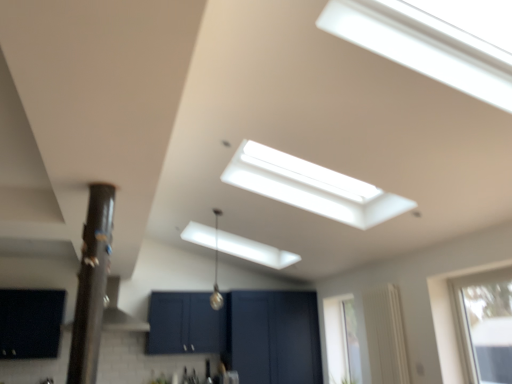
Describe the element at coordinates (119, 311) in the screenshot. I see `satin silver exhaust hood at left` at that location.

What do you see at coordinates (450, 319) in the screenshot?
I see `transparent glass window at upper right, acting as the 3th window starting from the back` at bounding box center [450, 319].

Locate an element on the screen. matte black cabinet at lower left, the second window viewed from the back is located at coordinates (30, 323).

Does point (480, 267) appear closer or farther from the camera than point (342, 312)?

Point (480, 267) is closer to the camera than point (342, 312).

Considering the relative positions of transparent glass window at upper right, acting as the 3th window starting from the back, and clear glass window at right, marked as the second window in a right-to-left arrangement, in the image provided, is transparent glass window at upper right, acting as the 3th window starting from the back, to the right of clear glass window at right, marked as the second window in a right-to-left arrangement, from the viewer's perspective?

Yes.

From the image's perspective, is transparent glass window at upper right, acting as the 3th window starting from the back, located above clear glass window at right, marked as the second window in a right-to-left arrangement?

Yes.

Measure the distance between transparent glass window at upper right, placed as the 1th window when sorted from front to back, and clear glass window at right, which ranks as the first window in back-to-front order.

transparent glass window at upper right, placed as the 1th window when sorted from front to back, and clear glass window at right, which ranks as the first window in back-to-front order, are 1.53 meters apart.

Could you tell me if matte black cabinet at lower left, the 2th window from the front, is facing metallic silver light fixture at upper center?

No.

What's the angular difference between matte black cabinet at lower left, which is counted as the 1th window, starting from the left, and metallic silver light fixture at upper center's facing directions?

There is a 89.8-degree angle between the facing directions of matte black cabinet at lower left, which is counted as the 1th window, starting from the left, and metallic silver light fixture at upper center.

From the picture: Do you think matte black cabinet at lower left, the 3th window viewed from the right, is within metallic silver light fixture at upper center, or outside of it?

matte black cabinet at lower left, the 3th window viewed from the right, cannot be found inside metallic silver light fixture at upper center.

Between matte black cabinet at lower left, the 2th window from the front, and metallic silver light fixture at upper center, which one is positioned in front?

metallic silver light fixture at upper center.

In the image, is satin silver exhaust hood at left positioned in front of or behind metallic silver light fixture at upper center?

Visually, satin silver exhaust hood at left is located behind metallic silver light fixture at upper center.

Is point (116, 321) closer to viewer compared to point (217, 212)?

No, (116, 321) is behind (217, 212).

From the image's perspective, is satin silver exhaust hood at left under metallic silver light fixture at upper center?

Correct, satin silver exhaust hood at left appears lower than metallic silver light fixture at upper center in the image.

What's the angular difference between satin silver exhaust hood at left and metallic silver light fixture at upper center's facing directions?

The facing directions of satin silver exhaust hood at left and metallic silver light fixture at upper center are 91 degrees apart.

Which object is thinner, matte black cabinet at lower left, the second window viewed from the back, or satin silver exhaust hood at left?

With smaller width is matte black cabinet at lower left, the second window viewed from the back.

Is matte black cabinet at lower left, the 3th window viewed from the right, with satin silver exhaust hood at left?

No, matte black cabinet at lower left, the 3th window viewed from the right, is not next to satin silver exhaust hood at left.

From the picture: Visually, is clear glass window at right, marked as the second window in a right-to-left arrangement, positioned to the left or to the right of transparent glass window at upper right, marked as the 3th window in a left-to-right arrangement?

Clearly, clear glass window at right, marked as the second window in a right-to-left arrangement, is on the left of transparent glass window at upper right, marked as the 3th window in a left-to-right arrangement, in the image.

In the scene shown: How many degrees apart are the facing directions of clear glass window at right, marked as the second window in a right-to-left arrangement, and transparent glass window at upper right, marked as the 3th window in a left-to-right arrangement?

The angular difference between clear glass window at right, marked as the second window in a right-to-left arrangement, and transparent glass window at upper right, marked as the 3th window in a left-to-right arrangement, is 0.122 degrees.

From the image's perspective, would you say clear glass window at right, which ranks as the first window in back-to-front order, is positioned over transparent glass window at upper right, acting as the 3th window starting from the back?

No, from the image's perspective, clear glass window at right, which ranks as the first window in back-to-front order, is not on top of transparent glass window at upper right, acting as the 3th window starting from the back.

In terms of size, does matte black cabinet at lower left, the second window viewed from the back, appear bigger or smaller than dark blue matte cabinet at center?

Considering their sizes, matte black cabinet at lower left, the second window viewed from the back, takes up less space than dark blue matte cabinet at center.

Find the location of a particular element. Image resolution: width=512 pixels, height=384 pixels. window above the dark blue matte cabinet at center (from a real-world perspective) is located at coordinates (30, 323).

Considering the relative sizes of matte black cabinet at lower left, the second window viewed from the back, and dark blue matte cabinet at center in the image provided, is matte black cabinet at lower left, the second window viewed from the back, shorter than dark blue matte cabinet at center?

Yes, matte black cabinet at lower left, the second window viewed from the back, is shorter than dark blue matte cabinet at center.

Consider the image. Is matte black cabinet at lower left, which is counted as the 1th window, starting from the left, wider or thinner than dark blue matte cabinet at center?

In the image, matte black cabinet at lower left, which is counted as the 1th window, starting from the left, appears to be more narrow than dark blue matte cabinet at center.

Is matte black cabinet at lower left, the 2th window from the front, spatially inside clear glass window at right, which ranks as the first window in back-to-front order, or outside of it?

matte black cabinet at lower left, the 2th window from the front, cannot be found inside clear glass window at right, which ranks as the first window in back-to-front order.

Looking at this image, what's the angular difference between matte black cabinet at lower left, the 3th window viewed from the right, and clear glass window at right, which ranks as the first window in back-to-front order,'s facing directions?

They differ by 88.6 degrees in their facing directions.

Is matte black cabinet at lower left, the second window viewed from the back, looking in the opposite direction of clear glass window at right, which is counted as the third window, starting from the front?

matte black cabinet at lower left, the second window viewed from the back, does not have its back to clear glass window at right, which is counted as the third window, starting from the front.

From a real-world perspective, who is located higher, matte black cabinet at lower left, the 2th window from the front, or clear glass window at right, which is the second window from left to right?

matte black cabinet at lower left, the 2th window from the front.

From the image's perspective, starting from the transparent glass window at upper right, positioned as the 1th window in right-to-left order, which window is the 2nd one below? Please provide its 2D coordinates.

[(342, 340)]

This screenshot has width=512, height=384. In order to click on window to the left of metallic silver light fixture at upper center in this screenshot , I will do `click(30, 323)`.

Which object lies nearer to the anchor point satin silver exhaust hood at left, dark blue matte cabinet at center or matte black cabinet at lower left, the second window viewed from the back?

The object closer to satin silver exhaust hood at left is matte black cabinet at lower left, the second window viewed from the back.

When comparing their distances from clear glass window at right, which ranks as the first window in back-to-front order, does dark blue matte cabinet at center or metallic silver light fixture at upper center seem closer?

dark blue matte cabinet at center.

Based on their spatial positions, is clear glass window at right, which is the second window from left to right, or dark blue matte cabinet at center closer to transparent glass window at upper right, placed as the 1th window when sorted from front to back?

clear glass window at right, which is the second window from left to right, lies closer to transparent glass window at upper right, placed as the 1th window when sorted from front to back, than the other object.

When comparing their distances from clear glass window at right, marked as the second window in a right-to-left arrangement, does dark blue matte cabinet at center or transparent glass window at upper right, positioned as the 1th window in right-to-left order, seem closer?

Based on the image, dark blue matte cabinet at center appears to be nearer to clear glass window at right, marked as the second window in a right-to-left arrangement.

From the image, which object appears to be farther from dark blue matte cabinet at center, transparent glass window at upper right, marked as the 3th window in a left-to-right arrangement, or metallic silver light fixture at upper center?

transparent glass window at upper right, marked as the 3th window in a left-to-right arrangement, is further to dark blue matte cabinet at center.

Looking at the image, which one is located further to transparent glass window at upper right, marked as the 3th window in a left-to-right arrangement, metallic silver light fixture at upper center or black glossy pole at left?

metallic silver light fixture at upper center is further to transparent glass window at upper right, marked as the 3th window in a left-to-right arrangement.

Estimate the real-world distances between objects in this image. Which object is closer to metallic silver light fixture at upper center, clear glass window at right, which is counted as the third window, starting from the front, or transparent glass window at upper right, marked as the 3th window in a left-to-right arrangement?

clear glass window at right, which is counted as the third window, starting from the front, lies closer to metallic silver light fixture at upper center than the other object.

Based on the photo, based on their spatial positions, is matte black cabinet at lower left, the 3th window viewed from the right, or transparent glass window at upper right, acting as the 3th window starting from the back, closer to black glossy pole at left?

Among the two, matte black cabinet at lower left, the 3th window viewed from the right, is located nearer to black glossy pole at left.

Where is `light fixture between black glossy pole at left and transparent glass window at upper right, marked as the 3th window in a left-to-right arrangement, in the horizontal direction`? light fixture between black glossy pole at left and transparent glass window at upper right, marked as the 3th window in a left-to-right arrangement, in the horizontal direction is located at coordinates (216, 269).

Where is `screen door located between satin silver exhaust hood at left and transparent glass window at upper right, placed as the 1th window when sorted from front to back, in the left-right direction`? screen door located between satin silver exhaust hood at left and transparent glass window at upper right, placed as the 1th window when sorted from front to back, in the left-right direction is located at coordinates 274,337.

Locate an element on the screen. Image resolution: width=512 pixels, height=384 pixels. light fixture situated between matte black cabinet at lower left, the 2th window from the front, and transparent glass window at upper right, acting as the 3th window starting from the back, from left to right is located at coordinates (216, 269).

This screenshot has height=384, width=512. Find the location of `pillar between matte black cabinet at lower left, the 2th window from the front, and transparent glass window at upper right, placed as the 1th window when sorted from front to back, in the horizontal direction`. pillar between matte black cabinet at lower left, the 2th window from the front, and transparent glass window at upper right, placed as the 1th window when sorted from front to back, in the horizontal direction is located at coordinates (91, 285).